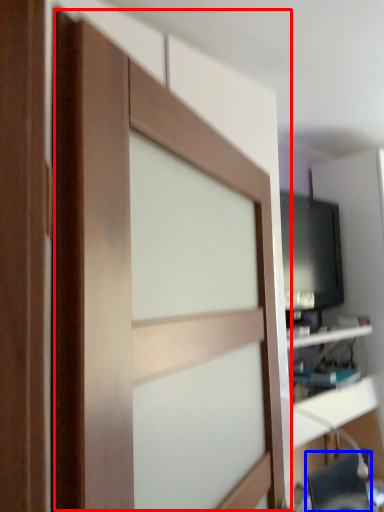
Question: Which point is closer to the camera, barn door (highlighted by a red box) or computer chair (highlighted by a blue box)?

Choices:
 (A) barn door
 (B) computer chair

Answer: (A)